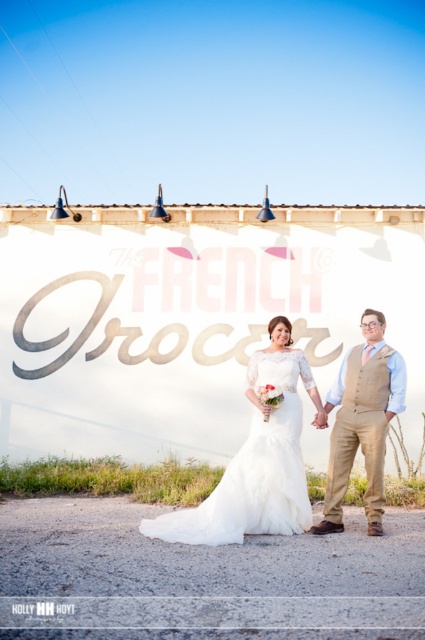
Between white satin dress at center and tan fabric vest at center, which one has more height?

With more height is tan fabric vest at center.

Which is more to the left, white satin dress at center or tan fabric vest at center?

Positioned to the left is white satin dress at center.

The height and width of the screenshot is (640, 425). I want to click on white satin dress at center, so click(x=257, y=460).